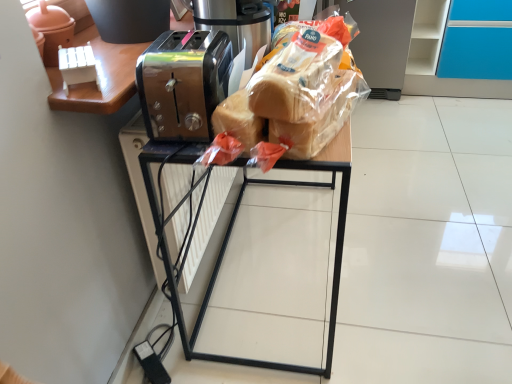
Question: Is translucent plastic bread at center, the 1th bread from the bottom, oriented towards metallic toaster at center?

Choices:
 (A) yes
 (B) no

Answer: (B)

Question: From a real-world perspective, is translucent plastic bread at center, which is the second bread in top-to-bottom order, below metallic toaster at center?

Choices:
 (A) yes
 (B) no

Answer: (B)

Question: Is translucent plastic bread at center, the 1th bread from the bottom, thinner than metallic toaster at center?

Choices:
 (A) no
 (B) yes

Answer: (B)

Question: Is translucent plastic bread at center, which is the second bread in top-to-bottom order, positioned with its back to metallic toaster at center?

Choices:
 (A) no
 (B) yes

Answer: (A)

Question: Considering the relative sizes of translucent plastic bread at center, which is the second bread in top-to-bottom order, and metallic toaster at center in the image provided, is translucent plastic bread at center, which is the second bread in top-to-bottom order, bigger than metallic toaster at center?

Choices:
 (A) yes
 (B) no

Answer: (B)

Question: Is translucent plastic bread at center, the 1th bread from the bottom, in contact with metallic toaster at center?

Choices:
 (A) no
 (B) yes

Answer: (A)

Question: Is metallic toaster at center located within translucent plastic bread at center?

Choices:
 (A) yes
 (B) no

Answer: (B)

Question: Considering the relative sizes of translucent plastic bread at center and metallic toaster at center in the image provided, is translucent plastic bread at center smaller than metallic toaster at center?

Choices:
 (A) no
 (B) yes

Answer: (A)

Question: Is translucent plastic bread at center with metallic toaster at center?

Choices:
 (A) no
 (B) yes

Answer: (A)

Question: From the image's perspective, does translucent plastic bread at center appear higher than metallic toaster at center?

Choices:
 (A) no
 (B) yes

Answer: (B)

Question: Is translucent plastic bread at center outside metallic toaster at center?

Choices:
 (A) no
 (B) yes

Answer: (B)

Question: From a real-world perspective, is translucent plastic bread at center on metallic toaster at center?

Choices:
 (A) yes
 (B) no

Answer: (B)

Question: Can you confirm if translucent plastic bread at center is taller than translucent plastic bread at center, the first bread positioned from the top?

Choices:
 (A) yes
 (B) no

Answer: (A)